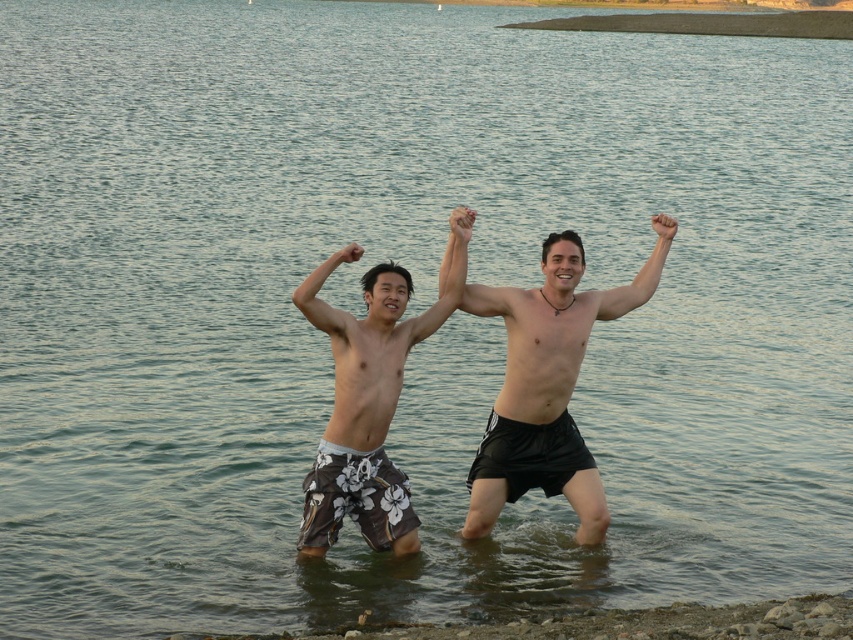
Can you confirm if floral-patterned shorts at center is bigger than matte black arm at upper center?

Indeed, floral-patterned shorts at center has a larger size compared to matte black arm at upper center.

Which is below, floral-patterned shorts at center or matte black arm at upper center?

floral-patterned shorts at center is below.

Who is more forward, (316, 516) or (659, 259)?

Point (316, 516) is in front.

Locate an element on the screen. floral-patterned shorts at center is located at coordinates (370, 392).

Is floral-patterned shorts at center smaller than black matte shorts at center?

Actually, floral-patterned shorts at center might be larger than black matte shorts at center.

Does floral-patterned shorts at center have a greater height compared to black matte shorts at center?

Indeed, floral-patterned shorts at center has a greater height compared to black matte shorts at center.

Between point (383, 492) and point (622, 307), which one is positioned behind?

Positioned behind is point (622, 307).

The width and height of the screenshot is (853, 640). I want to click on floral-patterned shorts at center, so click(370, 392).

Who is higher up, black matte shorts at center or matte floral shorts at center?

black matte shorts at center is higher up.

Can you confirm if black matte shorts at center is positioned above matte floral shorts at center?

Yes, black matte shorts at center is above matte floral shorts at center.

Where is `black matte shorts at center`? Image resolution: width=853 pixels, height=640 pixels. black matte shorts at center is located at coordinates (556, 324).

Where is `black matte shorts at center`? black matte shorts at center is located at coordinates (556, 324).